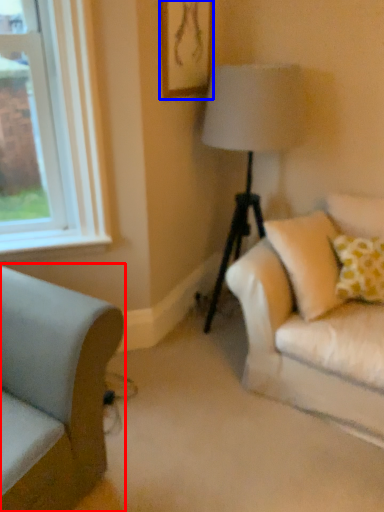
Question: Which object appears closest to the camera in this image, studio couch (highlighted by a red box) or picture frame (highlighted by a blue box)?

Choices:
 (A) studio couch
 (B) picture frame

Answer: (A)